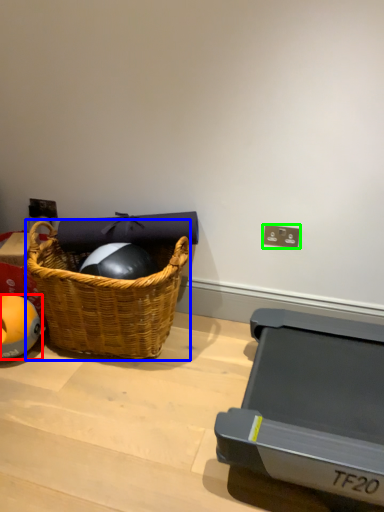
Question: Estimate the real-world distances between objects in this image. Which object is closer to ball (highlighted by a red box), picnic basket (highlighted by a blue box) or electric outlet (highlighted by a green box)?

Choices:
 (A) picnic basket
 (B) electric outlet

Answer: (A)